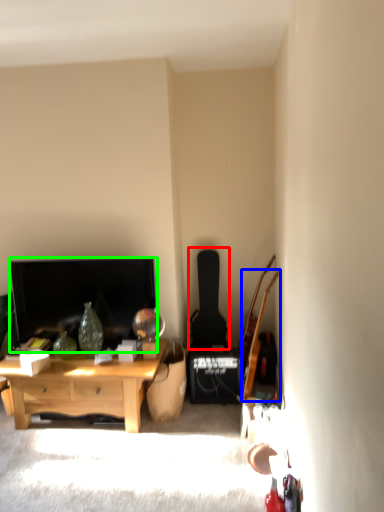
Question: Which object is the farthest from guitar (highlighted by a red box)? Choose among these: guitar (highlighted by a blue box) or television (highlighted by a green box).

Choices:
 (A) guitar
 (B) television

Answer: (B)